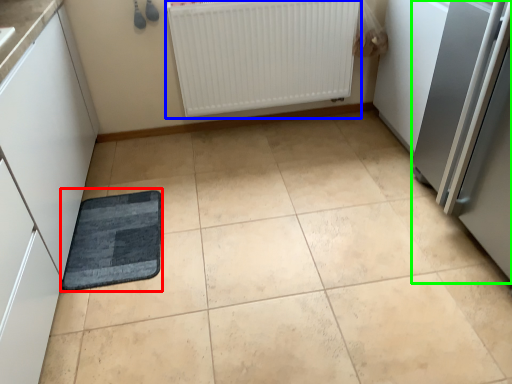
Question: Considering the real-world distances, which object is closest to mat (highlighted by a red box)? radiator (highlighted by a blue box) or appliance (highlighted by a green box).

Choices:
 (A) radiator
 (B) appliance

Answer: (A)